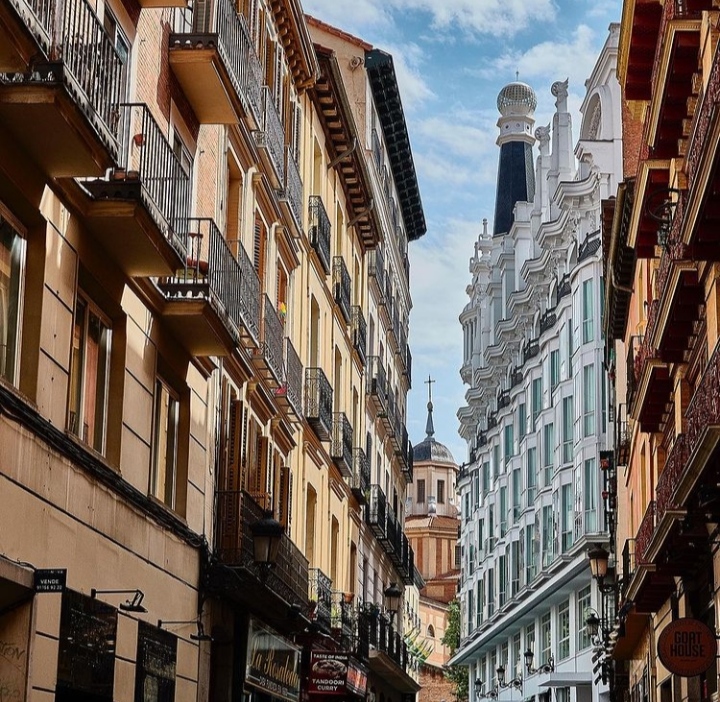
What are the coordinates of `lantern farthest to the right` in the screenshot? It's located at (598, 559).